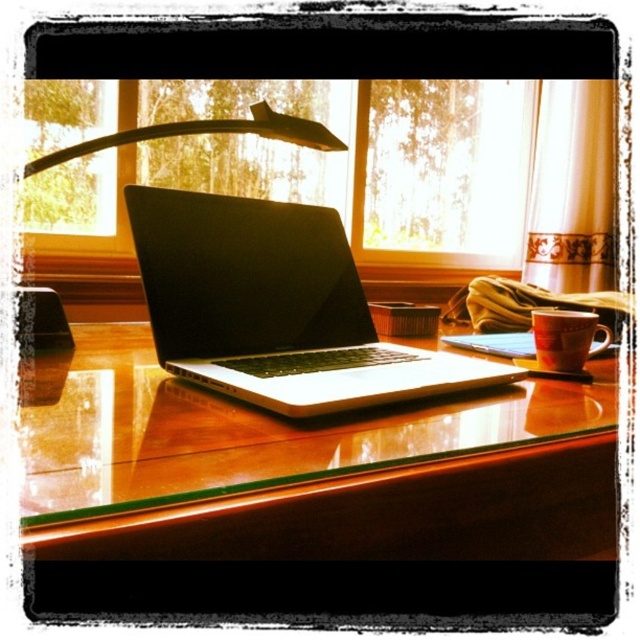
You are organizing a small table in the scene and need to place a new item between the black plastic lamp at upper center and the matte ceramic mug at right. The item you want to place is 8 inches long. Will there be enough space between them to fit this item?

The distance between the black plastic lamp at upper center and the matte ceramic mug at right is 16.36 inches. Since the item is 8 inches long, which is half of the available space, there will be enough space to place it between them.